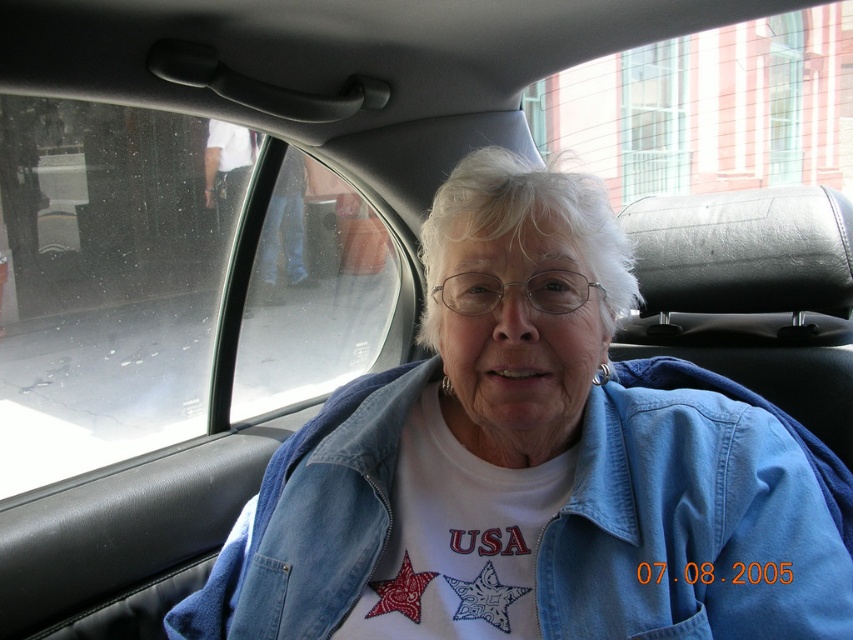
Question: From the image, what is the correct spatial relationship of denim jacket at lower right in relation to black leather headrest at upper right?

Choices:
 (A) left
 (B) right

Answer: (A)

Question: Which point is farther to the camera?

Choices:
 (A) denim jacket at lower right
 (B) transparent glass window at upper left
 (C) black leather headrest at upper right

Answer: (B)

Question: Which object is farther from the camera taking this photo?

Choices:
 (A) transparent glass window at upper left
 (B) denim jacket at lower right
 (C) black leather headrest at upper right

Answer: (A)

Question: Is denim jacket at lower right to the right of black leather headrest at upper right from the viewer's perspective?

Choices:
 (A) no
 (B) yes

Answer: (A)

Question: Among these points, which one is farthest from the camera?

Choices:
 (A) (662, 323)
 (B) (38, 477)
 (C) (614, 477)

Answer: (B)

Question: In this image, where is denim jacket at lower right located relative to black leather headrest at upper right?

Choices:
 (A) left
 (B) right

Answer: (A)